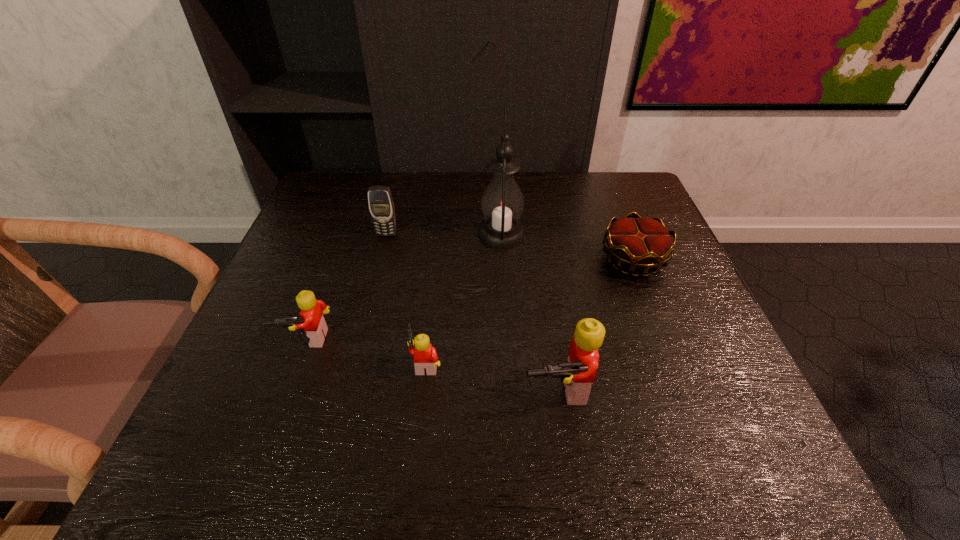
I want to click on the leftmost Lego, so click(x=312, y=310).

You are a GUI agent. You are given a task and a screenshot of the screen. Output one action in this format:
    pyautogui.click(x=<x>, y=<y>)
    Task: Click on the second tallest Lego
    
    Given the screenshot: What is the action you would take?
    pyautogui.click(x=312, y=310)

In order to click on the shortest Lego in this screenshot , I will do `click(425, 356)`.

Where is `the third object from left to right`? The height and width of the screenshot is (540, 960). the third object from left to right is located at coordinates (425, 356).

The width and height of the screenshot is (960, 540). Identify the location of the tallest Lego. (577, 375).

Find the location of a particular element. the rightmost Lego is located at coordinates (577, 375).

Identify the location of the shortest object. (640, 243).

In order to click on crown in this screenshot , I will do `click(640, 243)`.

At what (x,y) coordinates should I click in order to perform the action: click on oil lamp. Please return your answer as a coordinate pair (x, y). The width and height of the screenshot is (960, 540). Looking at the image, I should click on (502, 203).

Locate an element on the screen. This screenshot has width=960, height=540. cellular telephone is located at coordinates click(380, 201).